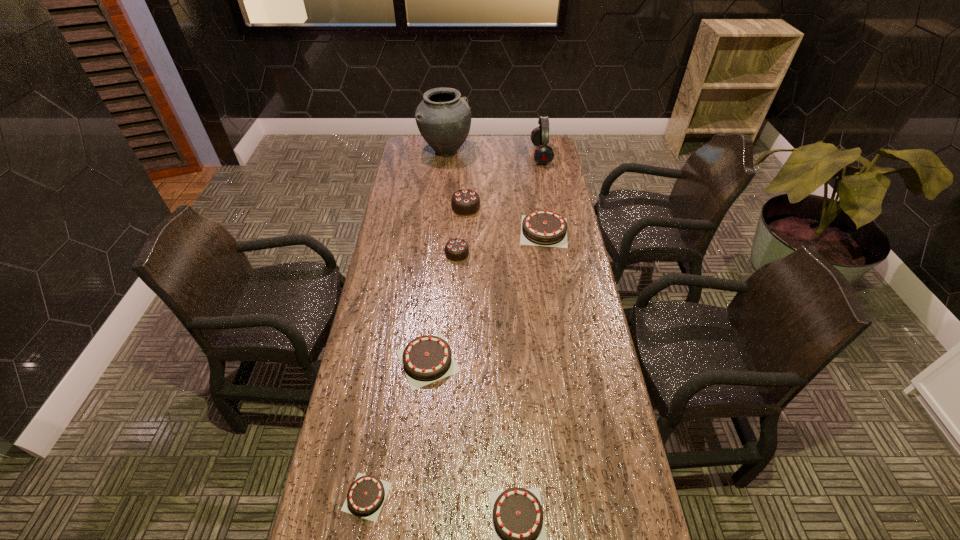
Image resolution: width=960 pixels, height=540 pixels. I want to click on free space at the left edge, so click(361, 357).

At what (x,y) coordinates should I click in order to perform the action: click on free point between the sixth shortest object and the urn. Please return your answer as a coordinate pair (x, y). Looking at the image, I should click on (456, 179).

This screenshot has height=540, width=960. Identify the location of free space between the tallest object and the second tallest object. (493, 153).

Locate an element on the screen. Image resolution: width=960 pixels, height=540 pixels. vacant area that lies between the bigger chocolate chocolate cake and the third shortest chocolate cake is located at coordinates (446, 284).

The image size is (960, 540). I want to click on vacant space in between the nearer chocolate chocolate cake and the farthest brown chocolate cake, so click(500, 242).

Choose which object is the sixth nearest neighbor to the nearer chocolate chocolate cake. Please provide its 2D coordinates. Your answer should be formatted as a tuple, i.e. [(x, y)], where the tuple contains the x and y coordinates of a point satisfying the conditions above.

[(366, 495)]

The image size is (960, 540). What are the coordinates of `the seventh closest object relative to the red earphone` in the screenshot? It's located at (366, 495).

Where is `chocolate cake that is the fourth closest to the smallest brown chocolate cake`? This screenshot has width=960, height=540. chocolate cake that is the fourth closest to the smallest brown chocolate cake is located at coordinates (542, 227).

This screenshot has height=540, width=960. In order to click on the third closest chocolate cake to the third nearest chocolate cake in this screenshot , I will do `click(456, 249)`.

Locate which brown chocolate cake ranks third in proximity to the black urn. Please provide its 2D coordinates. Your answer should be formatted as a tuple, i.e. [(x, y)], where the tuple contains the x and y coordinates of a point satisfying the conditions above.

[(366, 495)]